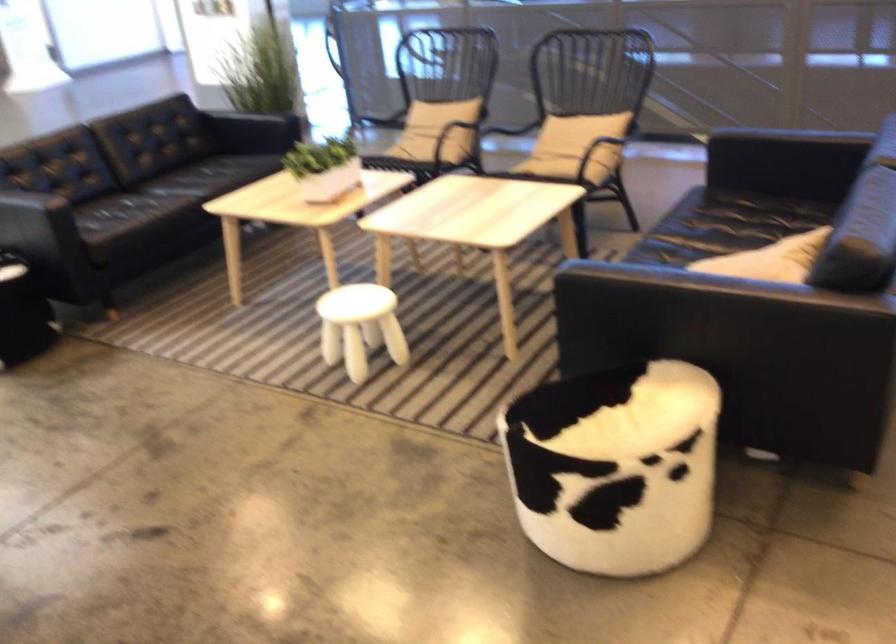
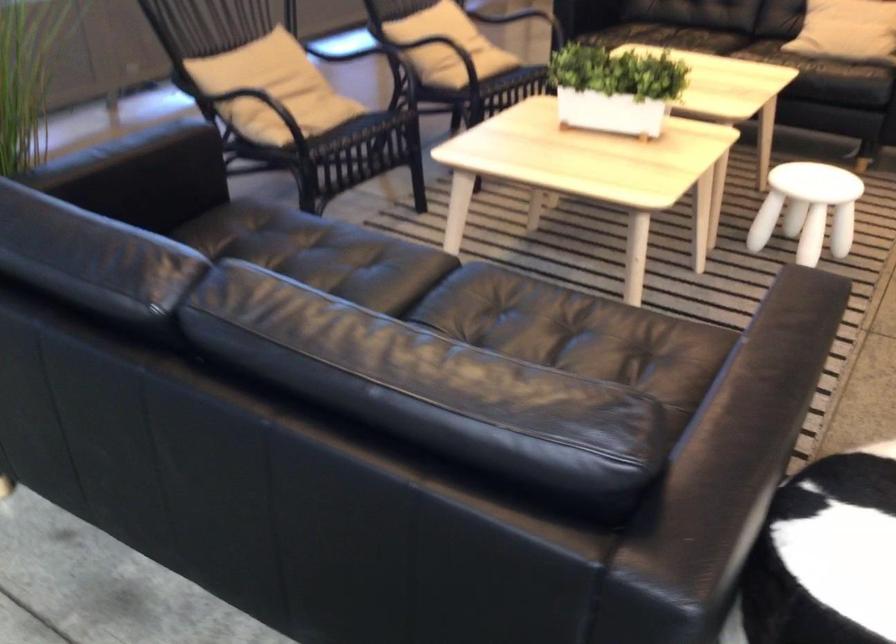
Find the pixel in the second image that matches pixel 349 317 in the first image.

(807, 209)